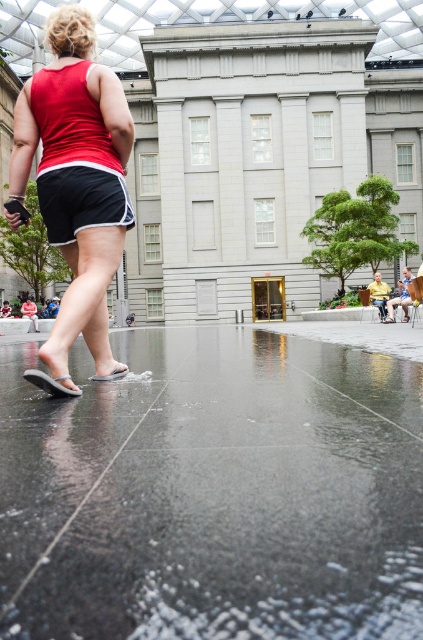
You are standing in the plaza and notice the glossy concrete pavement at lower center and the white rubber sandal at lower center. Which object is positioned to the right of the other?

The glossy concrete pavement at lower center is to the right of white rubber sandal at lower center.

You are standing in the plaza and notice the glossy concrete pavement at lower center and the white rubber sandal at lower left. Which object is positioned lower in the image?

The glossy concrete pavement at lower center is located below the white rubber sandal at lower left, meaning it is positioned lower in the image.

You are standing at the center of the plaza and see a person walking towards the building. There is a point marked at coordinates (51, 384) which corresponds to an object in the scene. What object is located at that point?

The point at (51, 384) marks the white rubber sandal at lower left.